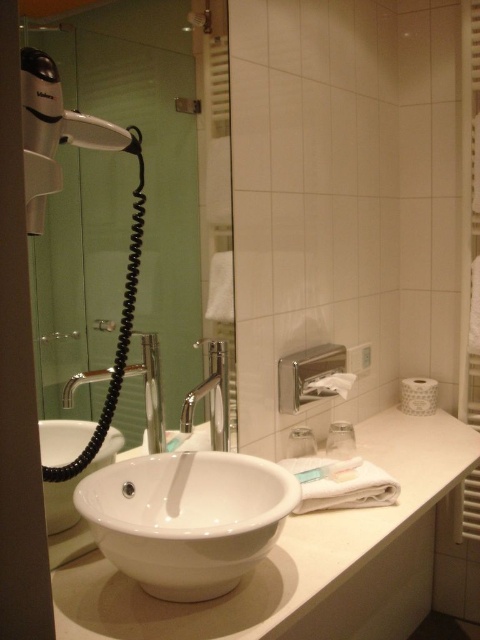
Question: Which point appears closest to the camera in this image?

Choices:
 (A) (156, 545)
 (B) (119, 141)
 (C) (127, 376)
 (D) (75, 577)

Answer: (A)

Question: Can you confirm if silver metallic faucet at left is bigger than clear plastic soap dispenser at center?

Choices:
 (A) no
 (B) yes

Answer: (B)

Question: Which of the following is the farthest from the observer?

Choices:
 (A) silver metallic faucet at left
 (B) polished chrome faucet at center
 (C) white glossy counter top at center

Answer: (B)

Question: Can you confirm if white plastic hair dryer at upper left is positioned below clear plastic soap dispenser at center?

Choices:
 (A) no
 (B) yes

Answer: (A)

Question: Which of the following is the closest to the observer?

Choices:
 (A) white matte soap at center
 (B) white glossy sink at center

Answer: (B)

Question: Can you confirm if white plastic radiator at lower right is positioned below polished chrome faucet at center?

Choices:
 (A) yes
 (B) no

Answer: (B)